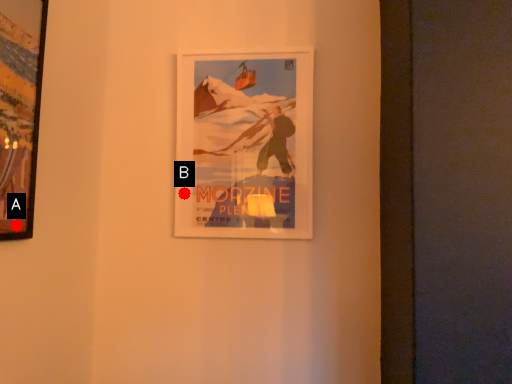
Question: Two points are circled on the image, labeled by A and B beside each circle. Which point is farther to the camera?

Choices:
 (A) A is further
 (B) B is further

Answer: (B)